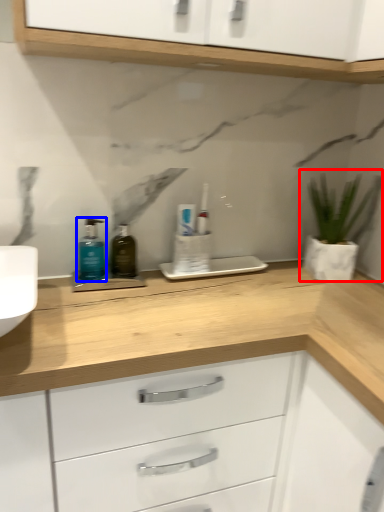
Question: Which object appears closest to the camera in this image, houseplant (highlighted by a red box) or toiletry (highlighted by a blue box)?

Choices:
 (A) houseplant
 (B) toiletry

Answer: (B)